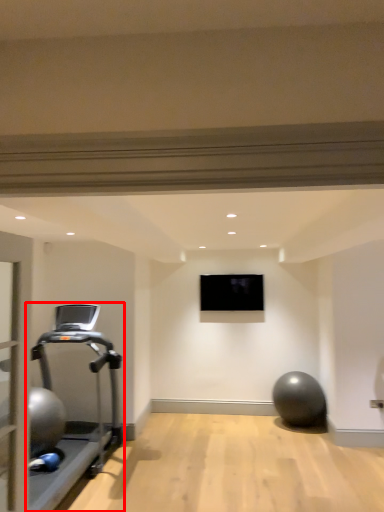
Question: In this image, where is treadmill (annotated by the red box) located relative to projection screen?

Choices:
 (A) left
 (B) right

Answer: (A)